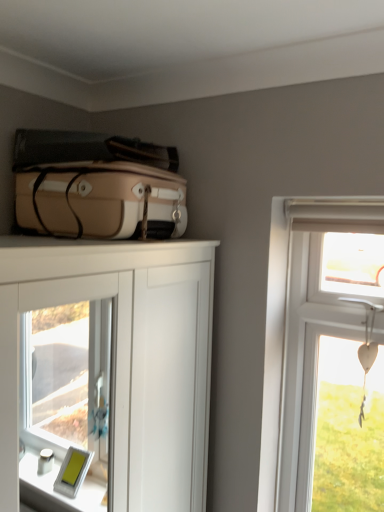
You are a GUI agent. You are given a task and a screenshot of the screen. Output one action in this format:
    pyautogui.click(x=<x>, y=<y>)
    Task: Click on the white glossy cabinet at center
    The width and height of the screenshot is (384, 512).
    Given the screenshot: What is the action you would take?
    pyautogui.click(x=107, y=372)

How different are the orientations of white glossy cabinet at center and white wooden heart at upper right in degrees?

89 degrees separate the facing orientations of white glossy cabinet at center and white wooden heart at upper right.

Is white glossy cabinet at center to the left or to the right of white wooden heart at upper right in the image?

Based on their positions, white glossy cabinet at center is located to the left of white wooden heart at upper right.

From the image's perspective, is white glossy cabinet at center over white wooden heart at upper right?

No.

Are white glossy cabinet at center and white wooden heart at upper right making contact?

There is a gap between white glossy cabinet at center and white wooden heart at upper right.

Between white wooden heart at upper right and matte beige suitcase at upper left, which one has larger size?

With larger size is matte beige suitcase at upper left.

From the image's perspective, does white wooden heart at upper right appear higher than matte beige suitcase at upper left?

No.

Is white wooden heart at upper right to the left of matte beige suitcase at upper left from the viewer's perspective?

In fact, white wooden heart at upper right is to the right of matte beige suitcase at upper left.

Based on the photo, does white wooden heart at upper right lie behind matte beige suitcase at upper left?

Yes, white wooden heart at upper right is further from the camera.

Is point (143, 169) positioned before point (139, 451)?

That is False.

Which of these two, matte beige suitcase at upper left or white glossy cabinet at center, stands shorter?

With less height is matte beige suitcase at upper left.

I want to click on cabinetry that is below the matte beige suitcase at upper left (from the image's perspective), so click(107, 372).

Which object is closer to the camera, matte beige suitcase at upper left or white glossy cabinet at center?

Positioned in front is white glossy cabinet at center.

From a real-world perspective, who is located higher, matte beige suitcase at upper left or white wooden heart at upper right?

In real-world perspective, matte beige suitcase at upper left is above.

Does matte beige suitcase at upper left touch white wooden heart at upper right?

They are not placed beside each other.

Does point (44, 172) come farther from viewer compared to point (310, 496)?

No, (44, 172) is closer to viewer.

Which is more to the left, matte beige suitcase at upper left or white wooden heart at upper right?

matte beige suitcase at upper left.

Locate an element on the screen. window above the white glossy cabinet at center (from a real-world perspective) is located at coordinates (312, 331).

Does point (302, 414) lie in front of point (157, 253)?

That is False.

Based on the photo, is white wooden heart at upper right facing away from white glossy cabinet at center?

white wooden heart at upper right does not have its back to white glossy cabinet at center.

Would you say white wooden heart at upper right is outside white glossy cabinet at center?

white wooden heart at upper right is positioned outside white glossy cabinet at center.

Which of these two, white glossy cabinet at center or matte beige suitcase at upper left, is bigger?

With larger size is white glossy cabinet at center.

In the scene shown: Can you confirm if white glossy cabinet at center is shorter than matte beige suitcase at upper left?

Answer: In fact, white glossy cabinet at center may be taller than matte beige suitcase at upper left.

Is white glossy cabinet at center next to matte beige suitcase at upper left?

No, white glossy cabinet at center is not in contact with matte beige suitcase at upper left.

How many degrees apart are the facing directions of white glossy cabinet at center and matte beige suitcase at upper left?

The facing directions of white glossy cabinet at center and matte beige suitcase at upper left are 0.000277 degrees apart.

Locate an element on the screen. cabinetry beneath the white wooden heart at upper right (from a real-world perspective) is located at coordinates (107, 372).

You are a GUI agent. You are given a task and a screenshot of the screen. Output one action in this format:
    pyautogui.click(x=<x>, y=<y>)
    Task: Click on the suitcase that is in front of the white wooden heart at upper right
    
    Given the screenshot: What is the action you would take?
    pyautogui.click(x=101, y=201)

Based on their spatial positions, is white glossy cabinet at center or matte beige suitcase at upper left closer to white wooden heart at upper right?

matte beige suitcase at upper left.

Which object lies nearer to the anchor point matte beige suitcase at upper left, white wooden heart at upper right or white glossy cabinet at center?

Among the two, white wooden heart at upper right is located nearer to matte beige suitcase at upper left.

Estimate the real-world distances between objects in this image. Which object is closer to white wooden heart at upper right, matte beige suitcase at upper left or white glossy cabinet at center?

matte beige suitcase at upper left is positioned closer to the anchor white wooden heart at upper right.

Based on their spatial positions, is white wooden heart at upper right or matte beige suitcase at upper left closer to white glossy cabinet at center?

Based on the image, matte beige suitcase at upper left appears to be nearer to white glossy cabinet at center.

Which object lies nearer to the anchor point white glossy cabinet at center, matte beige suitcase at upper left or white wooden heart at upper right?

matte beige suitcase at upper left is positioned closer to the anchor white glossy cabinet at center.

Which object lies nearer to the anchor point matte beige suitcase at upper left, white glossy cabinet at center or white wooden heart at upper right?

white wooden heart at upper right.

This screenshot has height=512, width=384. What are the coordinates of `suitcase situated between white glossy cabinet at center and white wooden heart at upper right from left to right` in the screenshot? It's located at (101, 201).